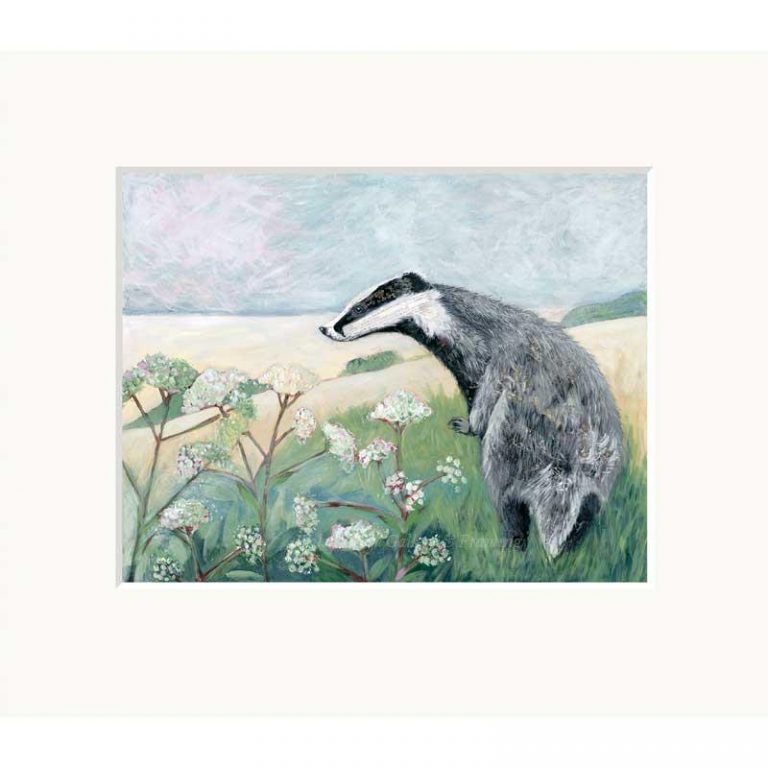
You are a GUI agent. You are given a task and a screenshot of the screen. Output one action in this format:
    pyautogui.click(x=<x>, y=<y>)
    Task: Click on the white fur
    
    Given the screenshot: What is the action you would take?
    pyautogui.click(x=432, y=312)